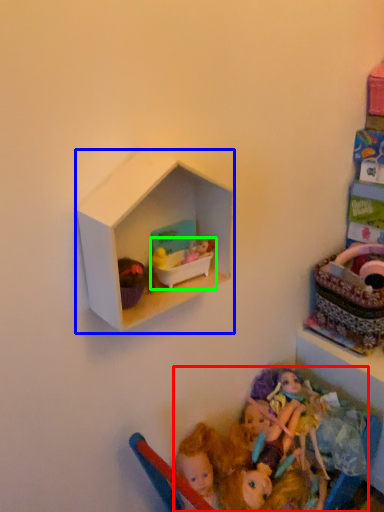
Question: Estimate the real-world distances between objects in this image. Which object is closer to doll (highlighted by a red box), shelf (highlighted by a blue box) or toy (highlighted by a green box)?

Choices:
 (A) shelf
 (B) toy

Answer: (B)